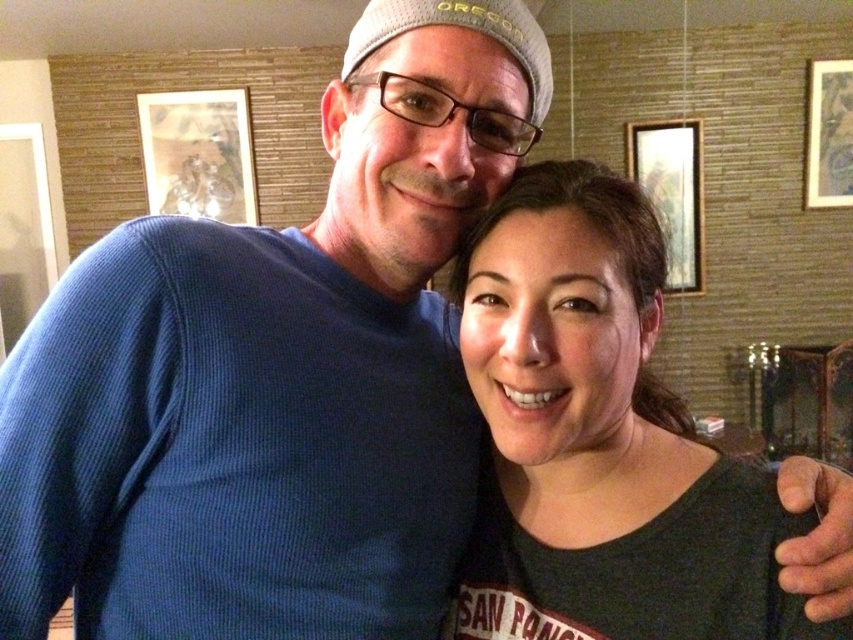
Is dark gray t-shirt at center wider than wooden picture frame at upper right?

Correct, the width of dark gray t-shirt at center exceeds that of wooden picture frame at upper right.

Which is below, dark gray t-shirt at center or wooden picture frame at upper right?

dark gray t-shirt at center

Where is `dark gray t-shirt at center`? Image resolution: width=853 pixels, height=640 pixels. dark gray t-shirt at center is located at coordinates (601, 440).

The width and height of the screenshot is (853, 640). What do you see at coordinates (199, 154) in the screenshot? I see `wooden frame at upper left` at bounding box center [199, 154].

Does wooden frame at upper left have a greater height compared to wooden framed artwork at upper right?

Incorrect, wooden frame at upper left's height is not larger of wooden framed artwork at upper right's.

Is point (236, 88) farther from viewer compared to point (685, 188)?

No, (236, 88) is closer to viewer.

This screenshot has width=853, height=640. In order to click on wooden frame at upper left in this screenshot , I will do `click(199, 154)`.

Does wooden frame at upper left have a smaller size compared to wooden picture frame at upper right?

No.

From the picture: Which is below, wooden frame at upper left or wooden picture frame at upper right?

wooden frame at upper left is below.

What are the coordinates of `wooden frame at upper left` in the screenshot? It's located at (199, 154).